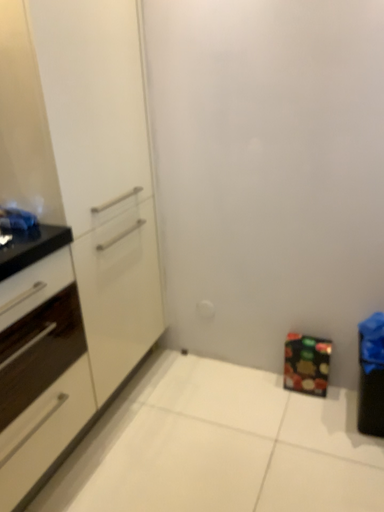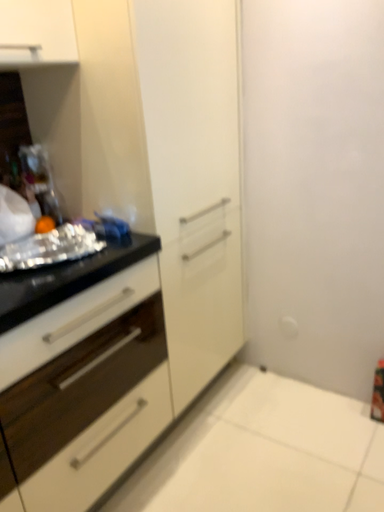
Question: Which way did the camera rotate in the video?

Choices:
 (A) rotated right
 (B) rotated left

Answer: (B)